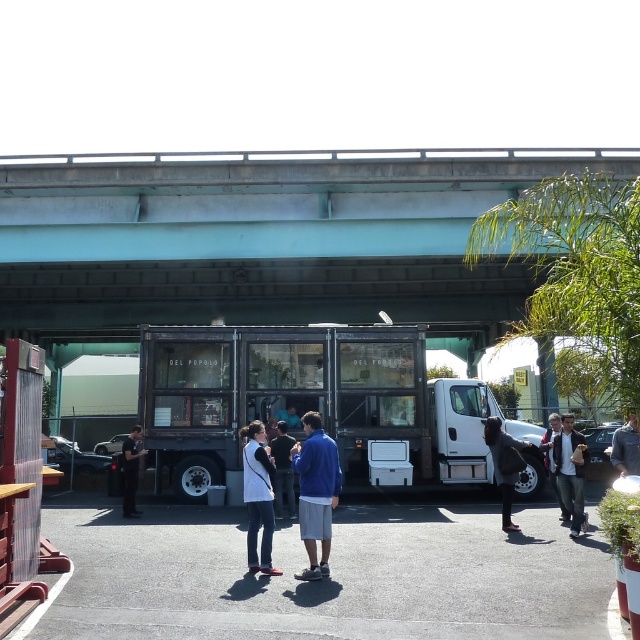
You are a customer standing at the entrance of the wooden panel food truck at center and want to reach the denim jacket at center. Which direction should you move to get there?

The wooden panel food truck at center is positioned on the left side of denim jacket at center, so you should move to the right to reach the denim jacket at center.

You are standing at the entrance of the overpass and want to find the wooden panel food truck at center. According to the coordinates provided, in which direction should you walk to reach it?

The wooden panel food truck at center is located at point (x=312, y=401). Since you are at the entrance of the overpass, which is likely at a lower coordinate, you should walk towards the center of the overpass area to reach the food truck.